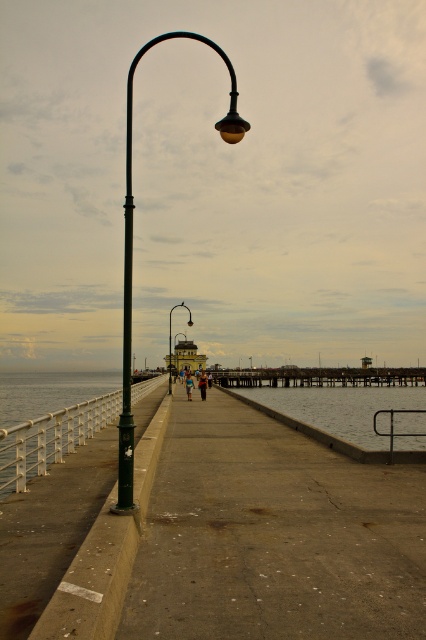
You are a photographer standing on the concrete pathway near the water. You want to take a photo that includes both the matte black lamp post at left and the blue fabric person at center. Which object should you position closer to the camera to ensure both are in focus?

The matte black lamp post at left is bigger than the blue fabric person at center, so positioning the lamp post closer to the camera will help keep both in focus as the larger object can be framed effectively while the smaller person remains within the depth of field.

You are standing at the edge of the pier and want to take a photo of both point (305, 388) and point (241, 358) in the scene. Which point will appear larger in your camera view?

Point (305, 388) is closer to the camera than point (241, 358), so it will appear larger in the camera view.